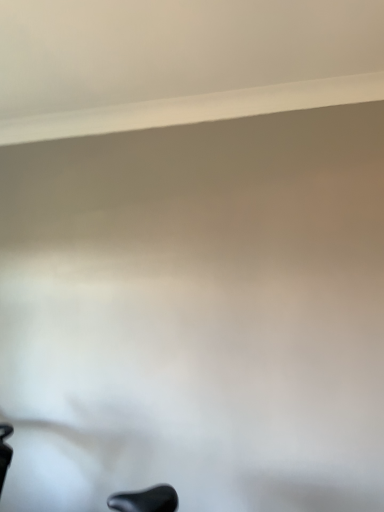
Question: Considering the positions of white smooth window sill at upper center and black matte swivel chair at lower left in the image, is white smooth window sill at upper center wider or thinner than black matte swivel chair at lower left?

Choices:
 (A) thin
 (B) wide

Answer: (A)

Question: Based on their sizes in the image, would you say white smooth window sill at upper center is bigger or smaller than black matte swivel chair at lower left?

Choices:
 (A) big
 (B) small

Answer: (B)

Question: Is point (253, 98) closer or farther from the camera than point (160, 495)?

Choices:
 (A) farther
 (B) closer

Answer: (A)

Question: Looking at the image, does black matte swivel chair at lower left seem bigger or smaller compared to white smooth window sill at upper center?

Choices:
 (A) small
 (B) big

Answer: (B)

Question: In terms of width, does black matte swivel chair at lower left look wider or thinner when compared to white smooth window sill at upper center?

Choices:
 (A) thin
 (B) wide

Answer: (B)

Question: Choose the correct answer: Is black matte swivel chair at lower left inside white smooth window sill at upper center or outside it?

Choices:
 (A) outside
 (B) inside

Answer: (A)

Question: From the image's perspective, is black matte swivel chair at lower left positioned above or below white smooth window sill at upper center?

Choices:
 (A) below
 (B) above

Answer: (A)